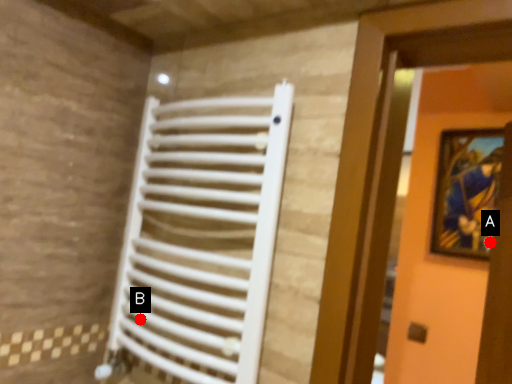
Question: Two points are circled on the image, labeled by A and B beside each circle. Which of the following is the closest to the observer?

Choices:
 (A) A is closer
 (B) B is closer

Answer: (B)